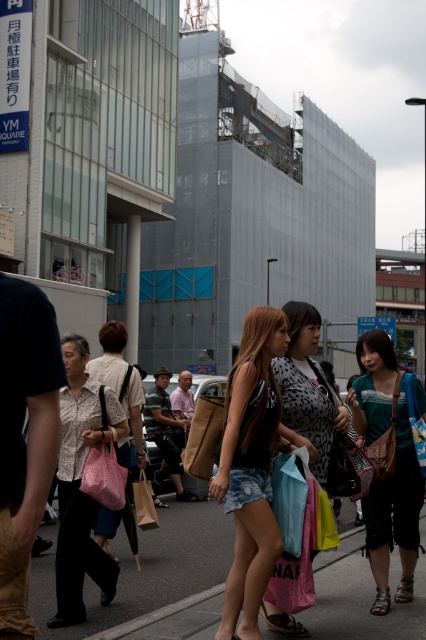
Question: Is matte floral blouse at lower left thinner than leopard print dress at center?

Choices:
 (A) no
 (B) yes

Answer: (B)

Question: Is smooth asphalt pavement at lower center closer to camera compared to teal fabric top at center?

Choices:
 (A) yes
 (B) no

Answer: (B)

Question: Among these points, which one is farthest from the camera?

Choices:
 (A) (26, 500)
 (B) (167, 435)

Answer: (B)

Question: Can you confirm if smooth asphalt pavement at lower center is wider than leopard print dress at center?

Choices:
 (A) yes
 (B) no

Answer: (A)

Question: Estimate the real-world distances between objects in this image. Which object is closer to the denim shorts at center?

Choices:
 (A) striped cotton shirt at center
 (B) teal fabric top at center
 (C) matte white blouse at center

Answer: (B)

Question: Which of the following is the closest to the observer?

Choices:
 (A) patterned fabric shirt at center
 (B) teal fabric top at center

Answer: (A)